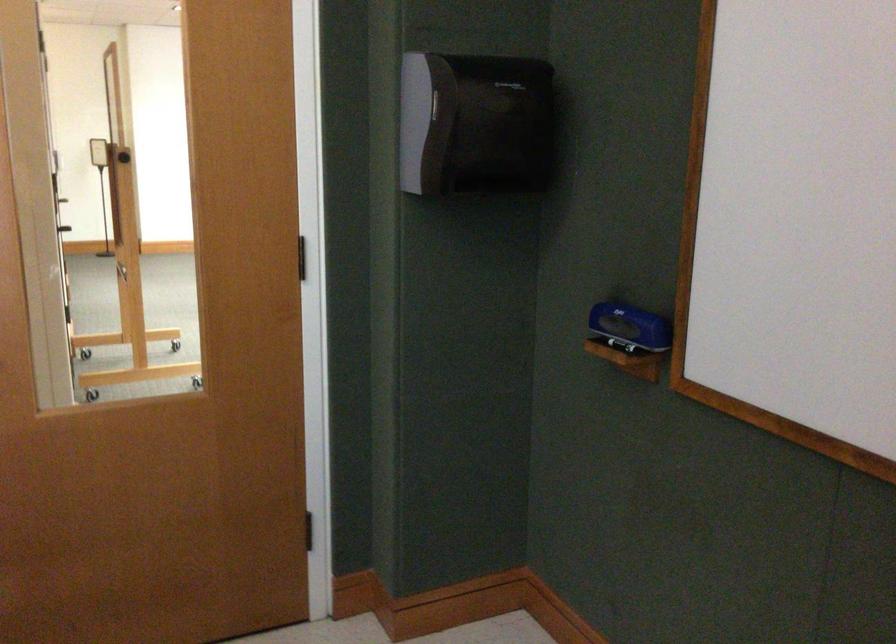
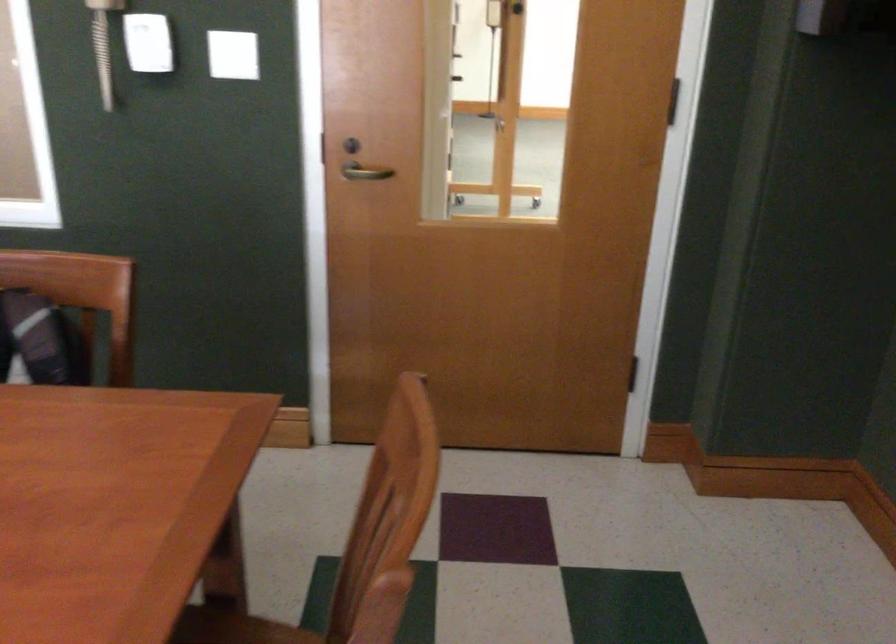
Question: The images are taken continuously from a first-person perspective. In which direction are you moving?

Choices:
 (A) Left
 (B) Right
 (C) Forward
 (D) Backward

Answer: (B)